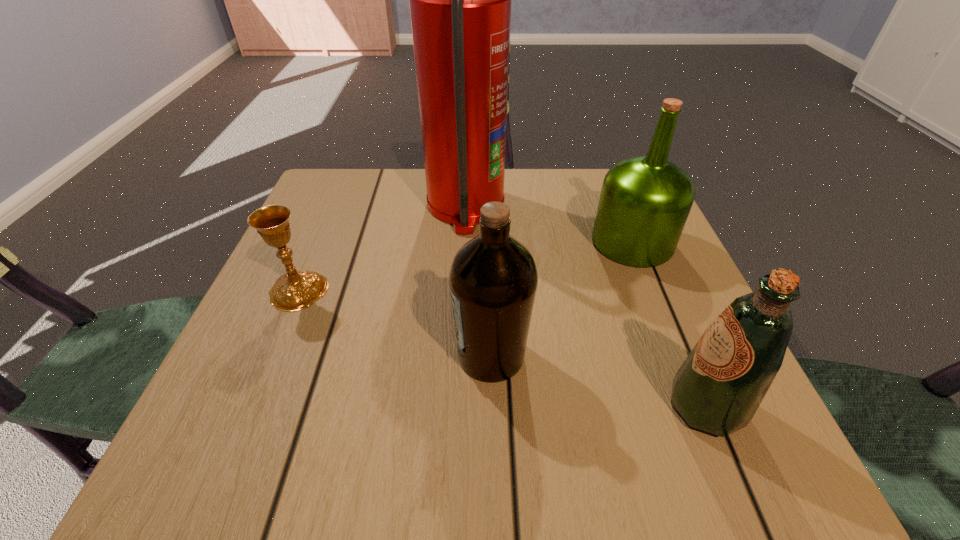
Where is `vacant space that satisfies the following two spatial constraints: 1. on the front side of the farthest olive oil; 2. on the label of the leftmost olive oil`? vacant space that satisfies the following two spatial constraints: 1. on the front side of the farthest olive oil; 2. on the label of the leftmost olive oil is located at coordinates (679, 355).

In order to click on free space that satisfies the following two spatial constraints: 1. on the instruction side of the fire extinguisher; 2. on the right side of the farthest olive oil in this screenshot , I will do `click(464, 242)`.

In order to click on free location that satisfies the following two spatial constraints: 1. on the front side of the farthest olive oil; 2. on the label of the leftmost olive oil in this screenshot , I will do `click(679, 355)`.